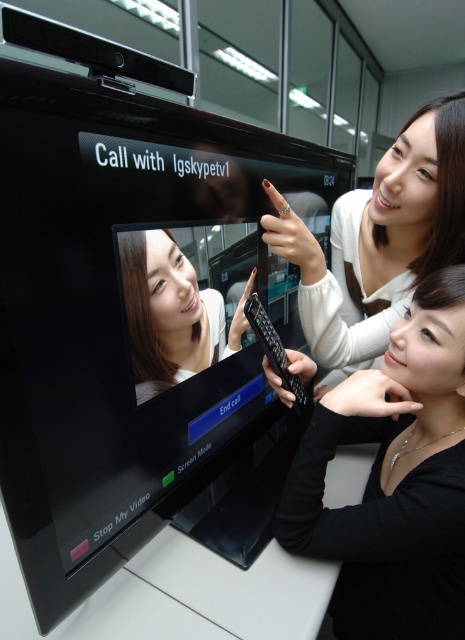
You are a technician trying to troubleshoot a remote control issue. You see the matte black remote control at center and the smooth skin face at center. Which object is bigger?

The matte black remote control at center is larger in size than the smooth skin face at center.

You are setting up a video call and need to locate both remotes. Based on the scene, where is the matte black remote control at center in relation to the black plastic remote at lower right?

The matte black remote control at center is above the black plastic remote at lower right.

You are setting up a video call and need to locate two remotes. You have the matte black remote control at center and the black plastic remote at lower right. Which remote is closer to the right edge of the TV stand?

The matte black remote control at center is positioned on the right side of the black plastic remote at lower right, so the matte black remote control at center is closer to the right edge of the TV stand.